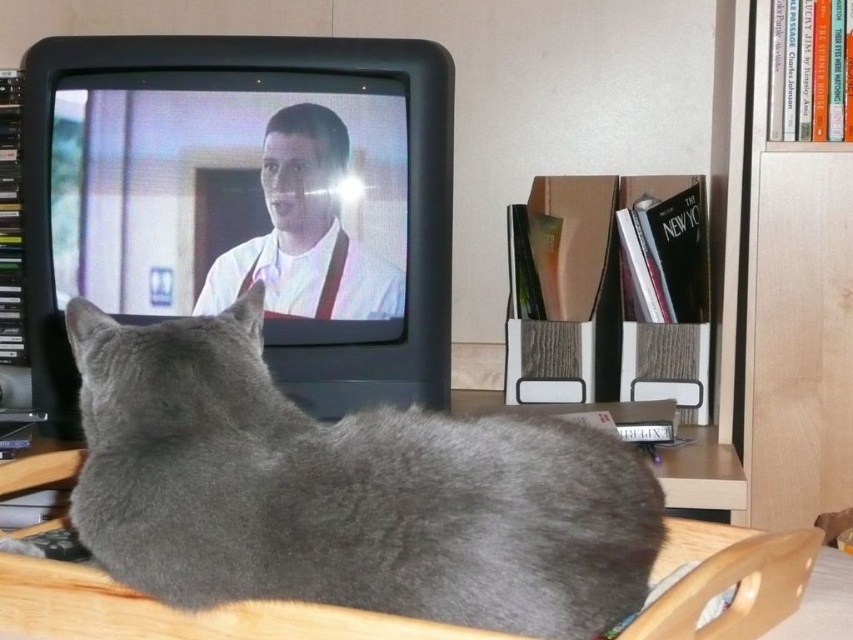
You are a small robot with a width of 18 inches. You want to move from the gray fur cat at center to the light brown wood bookshelf at right. Can you pass through the space between them?

The distance between the gray fur cat at center and the light brown wood bookshelf at right is 36.04 inches. Since the robot is 18 inches wide, it can easily pass through the space as the distance is more than double the robot width.

From the picture: You are a photographer trying to capture a photo of the gray fur cat at center and the light brown wood bookshelf at right. If you want to ensure both are in focus, which object should you place closer to the camera to achieve depth of field?

The gray fur cat at center is bigger than the light brown wood bookshelf at right, so to achieve depth of field, you should place the gray fur cat at center closer to the camera since larger objects often require closer focus to maintain sharpness in the frame.

From the picture: You are a photographer wanting to capture the gray fur cat at center and the light brown wood bookshelf at right in the same frame. Based on their positions, which object is closer to the left side of the image?

The gray fur cat at center is closer to the left side of the image than the light brown wood bookshelf at right.